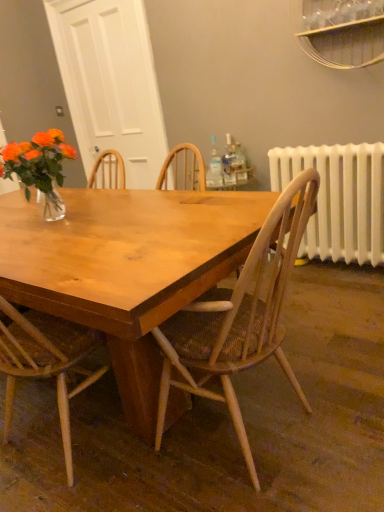
Question: Can you confirm if clear glass bottle at upper center, the 2th bottle in the left-to-right sequence, is thinner than wooden chair at center?

Choices:
 (A) no
 (B) yes

Answer: (B)

Question: Considering the relative sizes of clear glass bottle at upper center, marked as the second bottle in a right-to-left arrangement, and wooden chair at center in the image provided, is clear glass bottle at upper center, marked as the second bottle in a right-to-left arrangement, smaller than wooden chair at center?

Choices:
 (A) no
 (B) yes

Answer: (B)

Question: Can wooden chair at center be found inside clear glass bottle at upper center, marked as the second bottle in a right-to-left arrangement?

Choices:
 (A) no
 (B) yes

Answer: (A)

Question: Is clear glass bottle at upper center, the 2th bottle in the left-to-right sequence, taller than wooden chair at center?

Choices:
 (A) yes
 (B) no

Answer: (B)

Question: Considering the relative sizes of clear glass bottle at upper center, the 2th bottle in the left-to-right sequence, and wooden chair at center in the image provided, is clear glass bottle at upper center, the 2th bottle in the left-to-right sequence, bigger than wooden chair at center?

Choices:
 (A) no
 (B) yes

Answer: (A)

Question: Does clear glass bottle at upper center, the 2th bottle in the left-to-right sequence, lie in front of wooden chair at center?

Choices:
 (A) yes
 (B) no

Answer: (B)

Question: Is translucent plastic bottle at upper right, which ranks as the first bottle in right-to-left order, outside clear glass bottle at center, the 3th bottle when ordered from right to left?

Choices:
 (A) no
 (B) yes

Answer: (B)

Question: From a real-world perspective, is translucent plastic bottle at upper right, the 3th bottle positioned from the left, on clear glass bottle at center, the 3th bottle when ordered from right to left?

Choices:
 (A) yes
 (B) no

Answer: (B)

Question: Does translucent plastic bottle at upper right, the 3th bottle positioned from the left, have a larger size compared to clear glass bottle at center, which is the first bottle from left to right?

Choices:
 (A) yes
 (B) no

Answer: (B)

Question: Is translucent plastic bottle at upper right, which ranks as the first bottle in right-to-left order, far from clear glass bottle at center, which is the first bottle from left to right?

Choices:
 (A) no
 (B) yes

Answer: (A)

Question: Would you say translucent plastic bottle at upper right, which ranks as the first bottle in right-to-left order, contains clear glass bottle at center, which is the first bottle from left to right?

Choices:
 (A) yes
 (B) no

Answer: (B)

Question: Does translucent plastic bottle at upper right, which ranks as the first bottle in right-to-left order, come in front of clear glass bottle at center, the 3th bottle when ordered from right to left?

Choices:
 (A) no
 (B) yes

Answer: (A)

Question: Can you confirm if clear glass bottle at center, which is the first bottle from left to right, is wider than translucent plastic bottle at upper right, which ranks as the first bottle in right-to-left order?

Choices:
 (A) no
 (B) yes

Answer: (B)